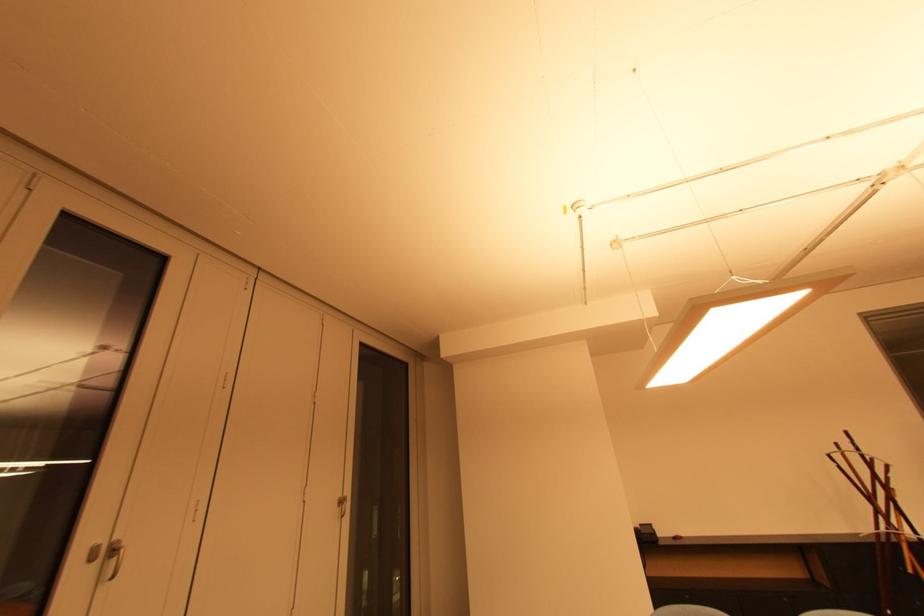
Find where to pull the metal door handle. Please return your answer as a coordinate pair (x, y).

(115, 557)